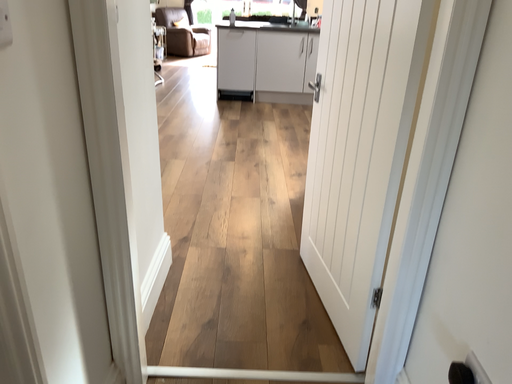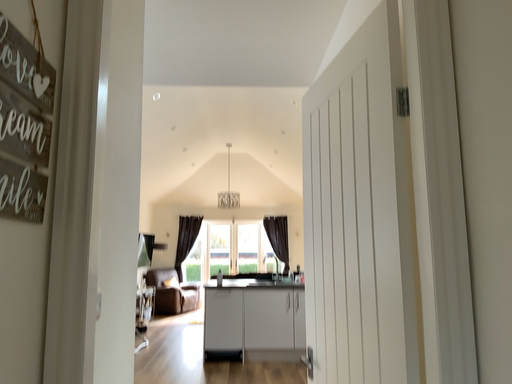
Question: How did the camera likely rotate when shooting the video?

Choices:
 (A) rotated upward
 (B) rotated downward

Answer: (A)